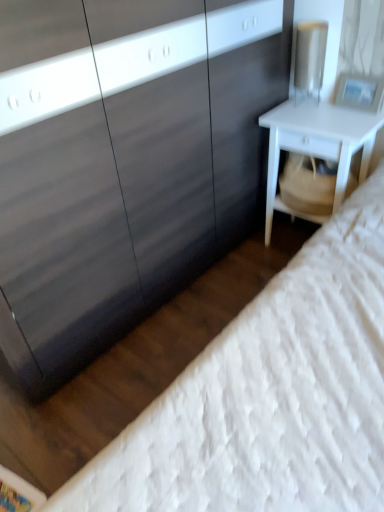
Question: Considering their positions, is white textured mattress at lower right located in front of or behind white matte nightstand at right?

Choices:
 (A) front
 (B) behind

Answer: (A)

Question: From their relative heights in the image, would you say white textured mattress at lower right is taller or shorter than white matte nightstand at right?

Choices:
 (A) tall
 (B) short

Answer: (A)

Question: Which of these objects is positioned farthest from the white textured mattress at lower right?

Choices:
 (A) matte black dresser at center
 (B) white matte nightstand at right

Answer: (B)

Question: Which is nearer to the white matte nightstand at right?

Choices:
 (A) white textured mattress at lower right
 (B) matte black dresser at center

Answer: (B)